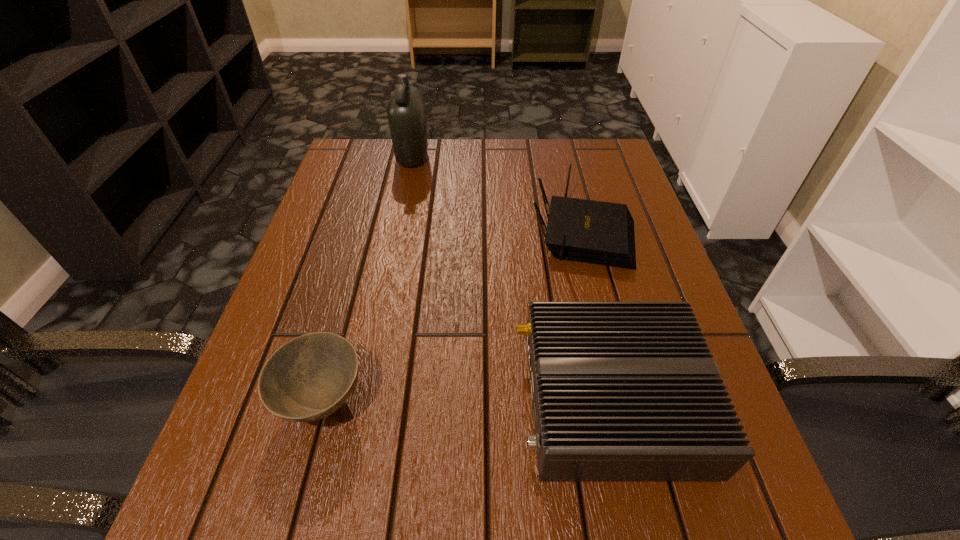
Find the location of a particular element. Image resolution: width=960 pixels, height=540 pixels. empty space between the bowl and the bottle is located at coordinates (368, 279).

What are the coordinates of `object that can be found as the third closest to the tallest object` in the screenshot? It's located at (308, 378).

Locate an element on the screen. This screenshot has width=960, height=540. object that stands as the third closest to the farthest object is located at coordinates (308, 378).

In order to click on free location that satisfies the following two spatial constraints: 1. on the back side of the farther router; 2. on the right side of the bowl in this screenshot , I will do `click(369, 233)`.

Where is `free region that satisfies the following two spatial constraints: 1. on the front side of the farthest object; 2. on the right side of the second farthest object`? free region that satisfies the following two spatial constraints: 1. on the front side of the farthest object; 2. on the right side of the second farthest object is located at coordinates (396, 233).

Image resolution: width=960 pixels, height=540 pixels. What are the coordinates of `vacant space that satisfies the following two spatial constraints: 1. on the front side of the farther router; 2. on the back panel of the nearer router` in the screenshot? It's located at (625, 400).